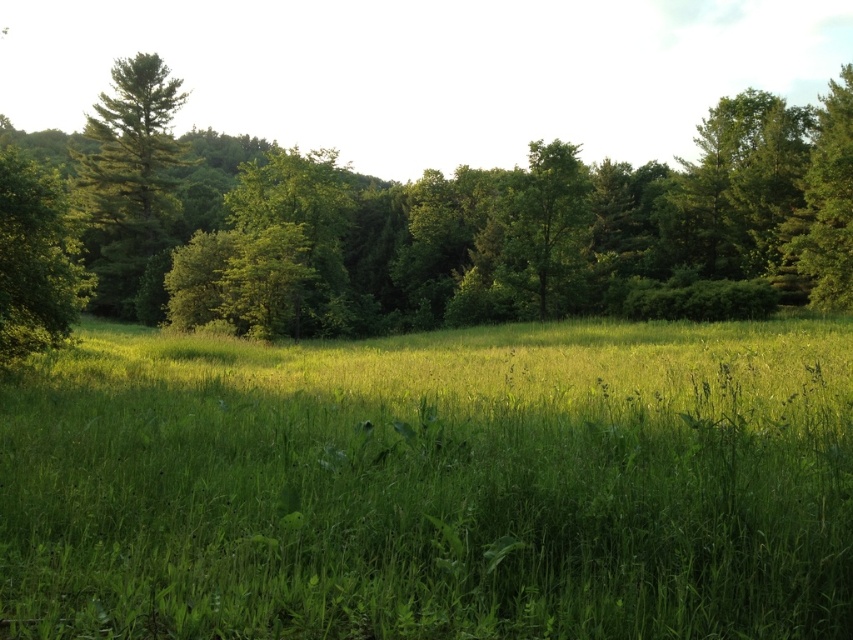
Question: Among these objects, which one is farthest from the camera?

Choices:
 (A) green matte tree at left
 (B) green matte tree at upper right

Answer: (A)

Question: Which point is closer to the camera?

Choices:
 (A) (836, 294)
 (B) (65, 276)
 (C) (105, 138)
 (D) (9, 273)

Answer: (D)

Question: Can you confirm if green leafy forest at center is positioned above green leafy tree at left?

Choices:
 (A) yes
 (B) no

Answer: (A)

Question: Which of the following is the closest to the observer?

Choices:
 (A) tap(4, 259)
 (B) tap(489, 580)

Answer: (B)

Question: Does green matte tree at left appear on the right side of green leafy tree at left?

Choices:
 (A) no
 (B) yes

Answer: (A)

Question: Can you confirm if green leafy forest at center is bigger than green matte tree at left?

Choices:
 (A) yes
 (B) no

Answer: (A)